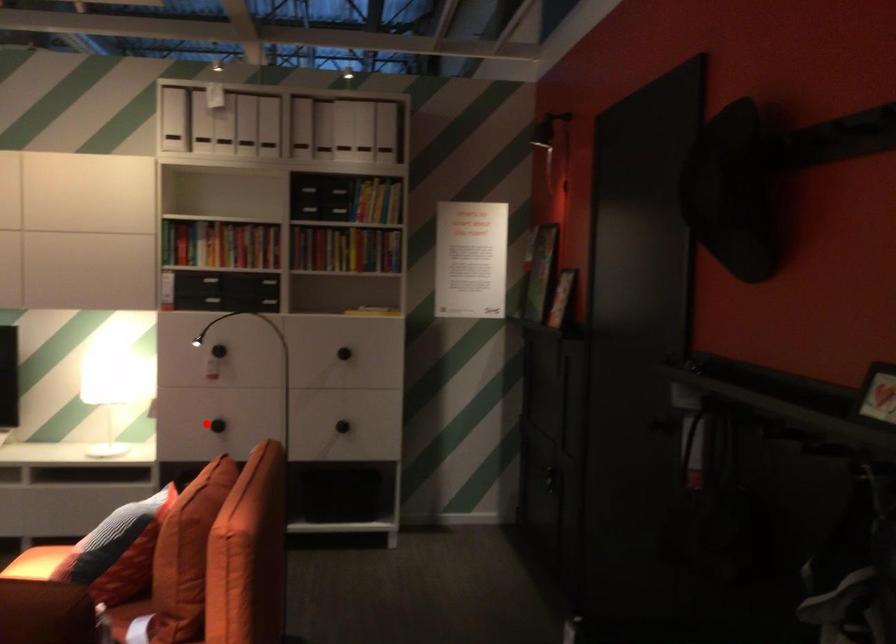
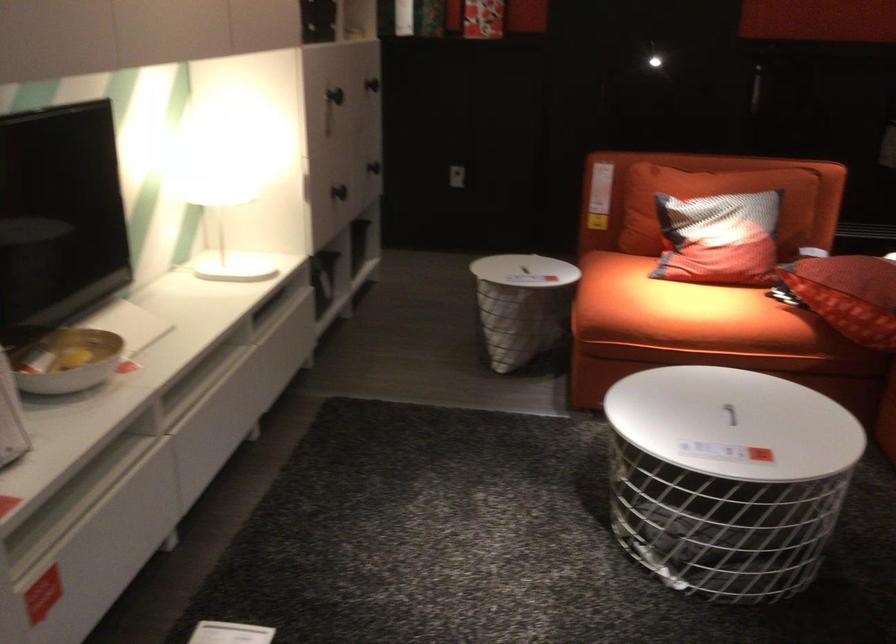
Question: I am providing you with two images of the same scene from different viewpoints. Given a red point in image1, look at the same physical point in image2. Is it:

Choices:
 (A) Closer to the viewpoint
 (B) Farther from the viewpoint

Answer: (A)